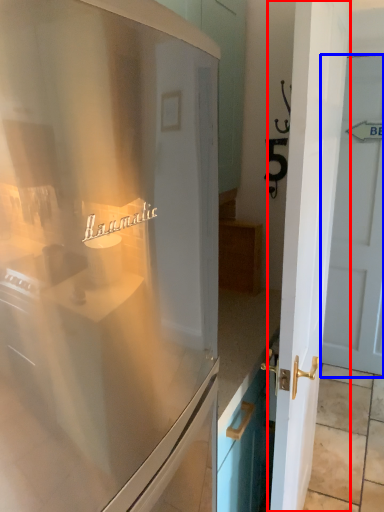
Question: Which object appears closest to the camera in this image, door (highlighted by a red box) or door (highlighted by a blue box)?

Choices:
 (A) door
 (B) door

Answer: (A)